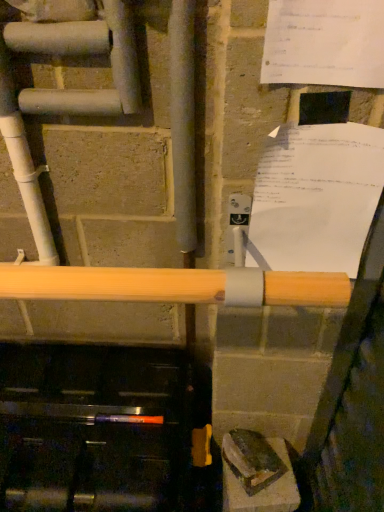
Question: Is white paper at upper right, which is the 2th paper from top to bottom, taller or shorter than white paper at upper right, marked as the second paper in a bottom-to-top arrangement?

Choices:
 (A) short
 (B) tall

Answer: (A)

Question: Is white paper at upper right, positioned as the second paper in front-to-back order, in front of or behind white paper at upper right, marked as the second paper in a bottom-to-top arrangement, in the image?

Choices:
 (A) front
 (B) behind

Answer: (B)

Question: Does point (301, 183) appear closer or farther from the camera than point (354, 32)?

Choices:
 (A) closer
 (B) farther

Answer: (B)

Question: Considering the positions of white paper at upper right, the 2th paper when ordered from back to front, and white paper at upper right, which is the 2th paper from top to bottom, in the image, is white paper at upper right, the 2th paper when ordered from back to front, wider or thinner than white paper at upper right, which is the 2th paper from top to bottom,?

Choices:
 (A) wide
 (B) thin

Answer: (B)

Question: Is white paper at upper right, marked as the second paper in a bottom-to-top arrangement, to the left or to the right of white paper at upper right, positioned as the second paper in front-to-back order, in the image?

Choices:
 (A) right
 (B) left

Answer: (B)

Question: Relative to white paper at upper right, arranged as the first paper when ordered from the bottom, is white paper at upper right, which ranks as the first paper in top-to-bottom order, in front or behind?

Choices:
 (A) front
 (B) behind

Answer: (A)

Question: From the image's perspective, relative to white paper at upper right, arranged as the first paper when ordered from the bottom, is white paper at upper right, marked as the 1th paper in a front-to-back arrangement, above or below?

Choices:
 (A) above
 (B) below

Answer: (A)